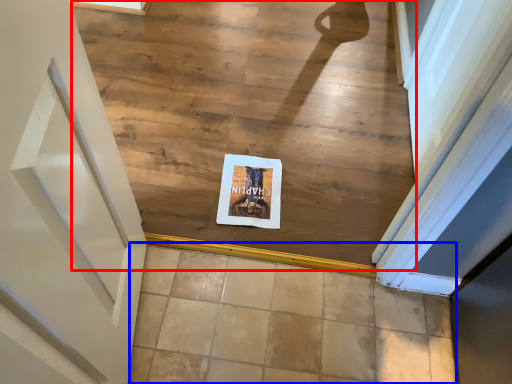
Question: Which of the following is the farthest to the observer, stairwell (highlighted by a red box) or tile (highlighted by a blue box)?

Choices:
 (A) stairwell
 (B) tile

Answer: (A)